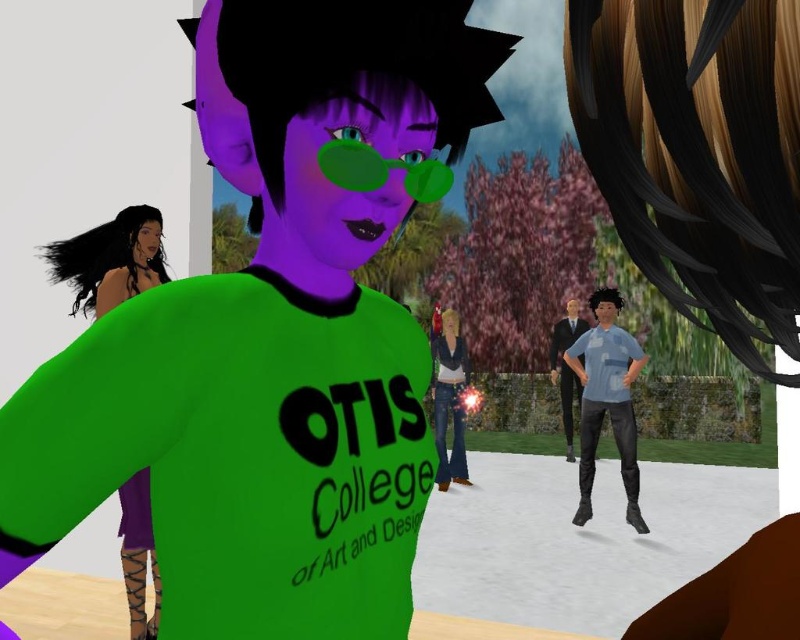
Does denim jeans at center have a lesser width compared to light blue denim jeans at center?

Correct, denim jeans at center's width is less than light blue denim jeans at center's.

The image size is (800, 640). What do you see at coordinates (449, 397) in the screenshot? I see `denim jeans at center` at bounding box center [449, 397].

The height and width of the screenshot is (640, 800). I want to click on denim jeans at center, so click(x=449, y=397).

At what (x,y) coordinates should I click in order to perform the action: click on denim jeans at center. Please return your answer as a coordinate pair (x, y). This screenshot has height=640, width=800. Looking at the image, I should click on (449, 397).

Does light blue fabric shirt at center come behind light blue denim jeans at center?

No, it is not.

Does light blue fabric shirt at center have a greater width compared to light blue denim jeans at center?

Indeed, light blue fabric shirt at center has a greater width compared to light blue denim jeans at center.

Which is in front, point (628, 448) or point (576, 330)?

Point (628, 448) is more forward.

Find the location of `light blue fabric shirt at center`. light blue fabric shirt at center is located at coordinates (606, 400).

Which is below, light blue fabric shirt at center or denim jeans at center?

denim jeans at center

Looking at this image, is light blue fabric shirt at center further to the viewer compared to denim jeans at center?

No.

Does point (613, 360) come in front of point (452, 388)?

Yes, it is.

Identify the location of light blue fabric shirt at center. (606, 400).